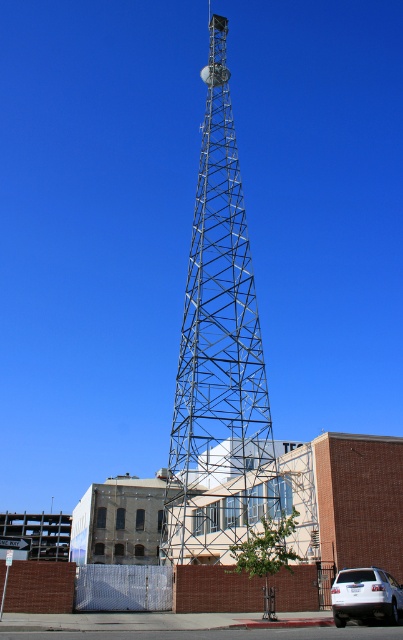
You are a pedestrian standing on the sidewalk near the metallic lattice tower at center and the white matte suv at lower right. Which object is closer to your left side?

The metallic lattice tower at center is to the left of the white matte suv at lower right, so it is closer to your left side.

You are standing at the base of the tall metallic lattice tower in the center of the image. You want to walk to the point marked at coordinates [186,541]. How far will you have to walk in feet?

The point at coordinates [186,541] is 206.10 feet away from the viewer, so you will have to walk 206.10 feet to reach it.

You are standing at the base of the metallic lattice tower in the center of the image. You see two points marked on the tower, one at point coordinates point (255,460) and the other at point (371,602). Which point is closer to the top of the tower?

Point (371,602) is closer to the top of the tower because it is located higher up than point (255,460).